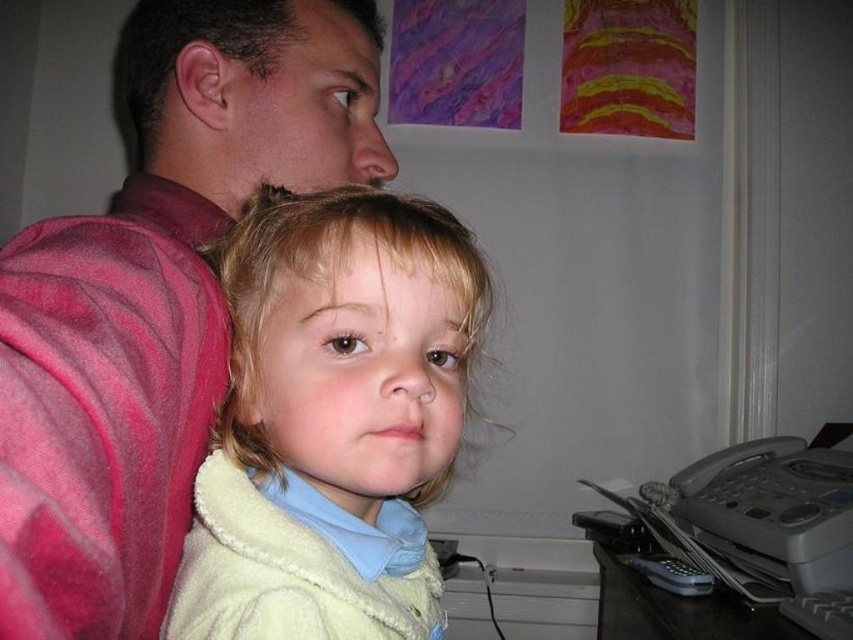
Question: Which point appears farthest from the camera in this image?

Choices:
 (A) (115, 456)
 (B) (334, 326)

Answer: (B)

Question: Estimate the real-world distances between objects in this image. Which object is closer to the matte pink shirt at upper left?

Choices:
 (A) velvety pink robe at left
 (B) fluffy yellow jacket at center

Answer: (A)

Question: Which point appears farthest from the camera in this image?

Choices:
 (A) (163, 433)
 (B) (33, 378)

Answer: (A)

Question: Can you confirm if matte pink shirt at upper left is smaller than fluffy yellow jacket at center?

Choices:
 (A) yes
 (B) no

Answer: (B)

Question: Can you confirm if matte pink shirt at upper left is positioned above fluffy yellow jacket at center?

Choices:
 (A) yes
 (B) no

Answer: (A)

Question: In this image, where is matte pink shirt at upper left located relative to velvety pink robe at left?

Choices:
 (A) above
 (B) below

Answer: (A)